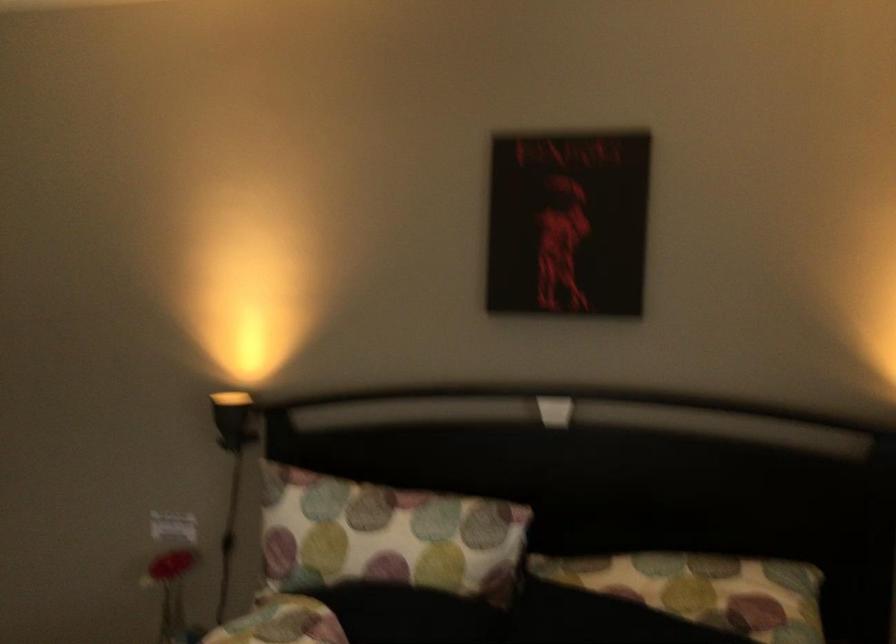
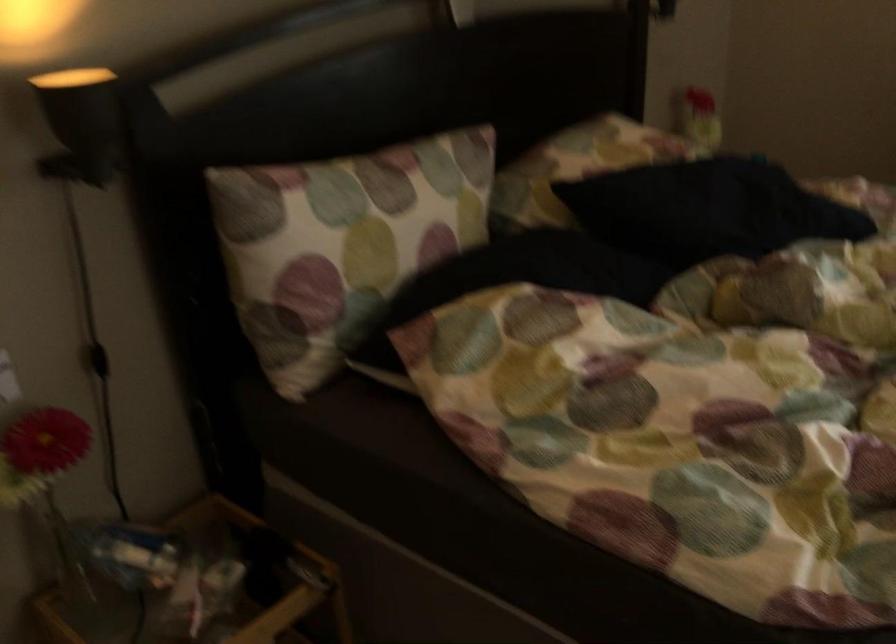
Locate, in the second image, the point that corresponds to (x=158, y=574) in the first image.

(46, 480)